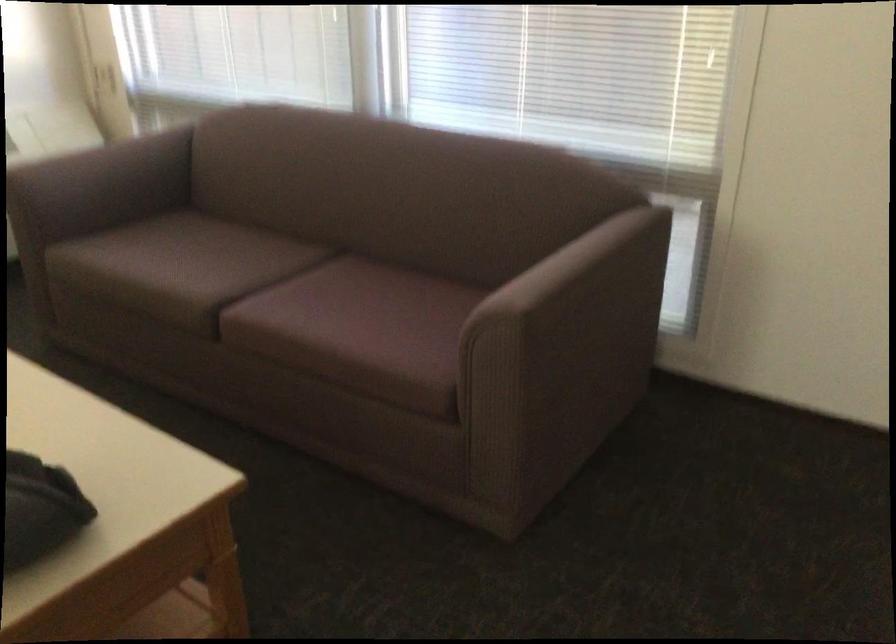
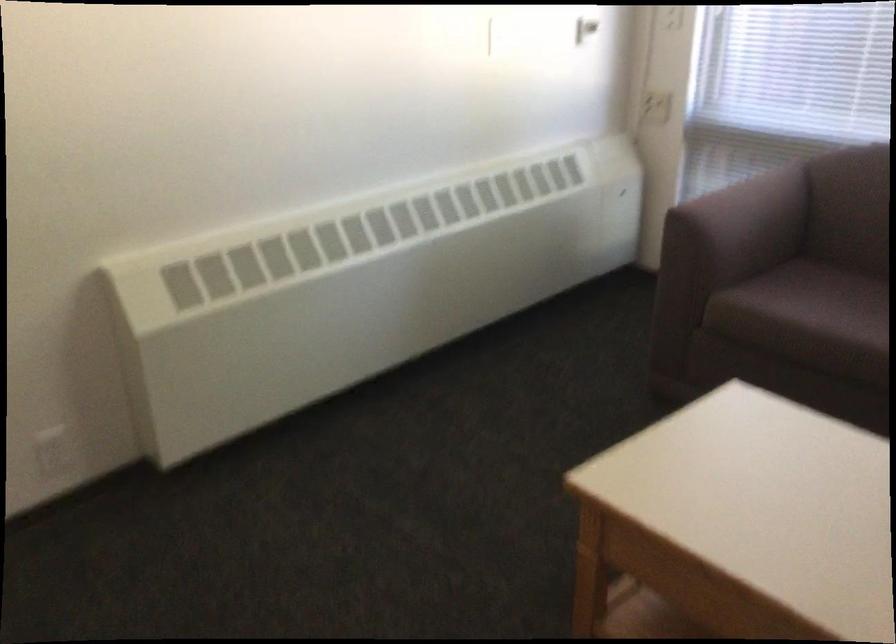
Find the pixel in the second image that matches point (93, 77) in the first image.

(656, 107)